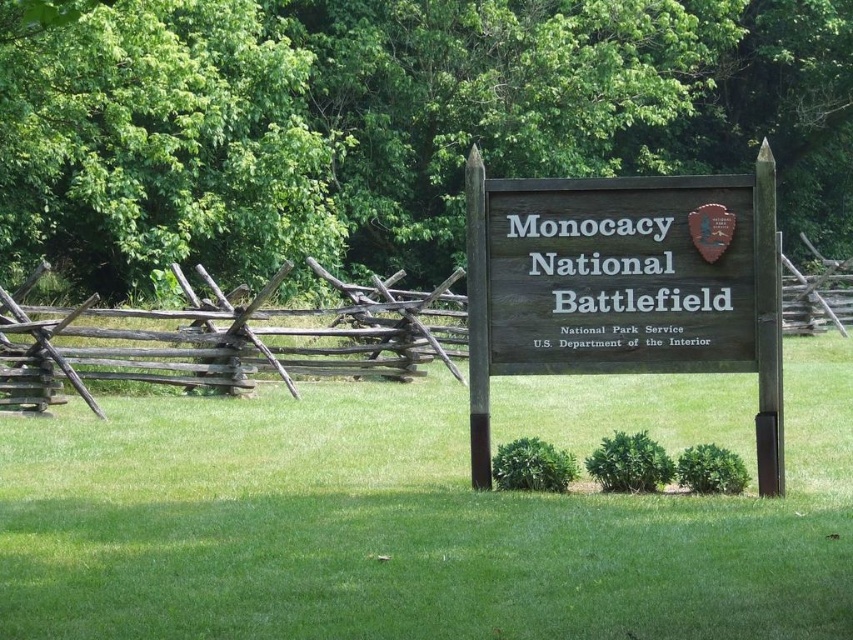
Who is positioned more to the right, wooden sign at center or weathered wood fence at center?

weathered wood fence at center

Between wooden sign at center and weathered wood fence at center, which one appears on the left side from the viewer's perspective?

From the viewer's perspective, wooden sign at center appears more on the left side.

Identify the location of wooden sign at center. (624, 285).

Locate an element on the screen. wooden sign at center is located at coordinates (624, 285).

Is point (306, 604) in front of point (773, 433)?

That is True.

Where is `green grass at center`? green grass at center is located at coordinates (422, 515).

At what (x,y) coordinates should I click in order to perform the action: click on green grass at center. Please return your answer as a coordinate pair (x, y). Image resolution: width=853 pixels, height=640 pixels. Looking at the image, I should click on (422, 515).

This screenshot has height=640, width=853. Describe the element at coordinates (422, 515) in the screenshot. I see `green grass at center` at that location.

Does green grass at center have a lesser width compared to weathered wood fence at left?

No.

Between point (173, 440) and point (229, 372), which one is positioned in front?

Positioned in front is point (173, 440).

Where is `green grass at center`? The image size is (853, 640). green grass at center is located at coordinates (422, 515).